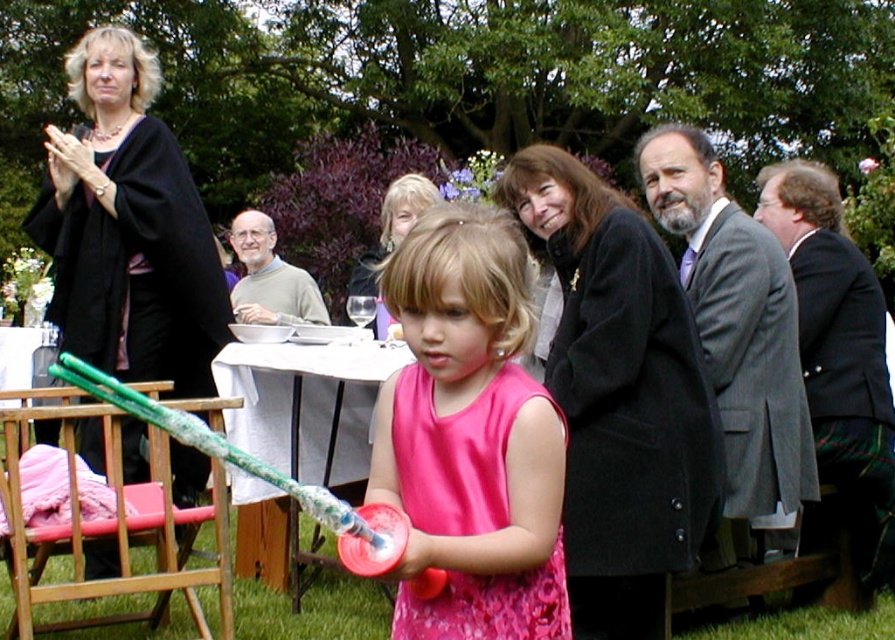
Question: Which object is positioned farthest from the gray wool sweater at upper center?

Choices:
 (A) pink satin dress at center
 (B) green plaid kilt at right
 (C) gray wool suit at upper right

Answer: (A)

Question: Can you confirm if gray wool suit at upper right is wider than green plaid kilt at right?

Choices:
 (A) yes
 (B) no

Answer: (A)

Question: Which object is farther from the camera taking this photo?

Choices:
 (A) gray wool suit at upper right
 (B) gray wool sweater at upper center
 (C) green plaid kilt at right
 (D) pink satin dress at center

Answer: (B)

Question: Observing the image, what is the correct spatial positioning of green plaid kilt at right in reference to gray wool sweater at upper center?

Choices:
 (A) below
 (B) above

Answer: (A)

Question: Where is pink satin dress at center located in relation to gray wool sweater at upper center in the image?

Choices:
 (A) below
 (B) above

Answer: (A)

Question: Estimate the real-world distances between objects in this image. Which object is closer to the gray wool suit at upper right?

Choices:
 (A) gray wool sweater at upper center
 (B) pink satin dress at center

Answer: (B)